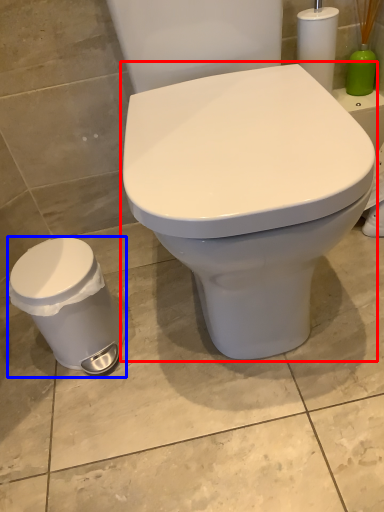
Question: Which object appears closest to the camera in this image, toilet (highlighted by a red box) or porcelain (highlighted by a blue box)?

Choices:
 (A) toilet
 (B) porcelain

Answer: (A)